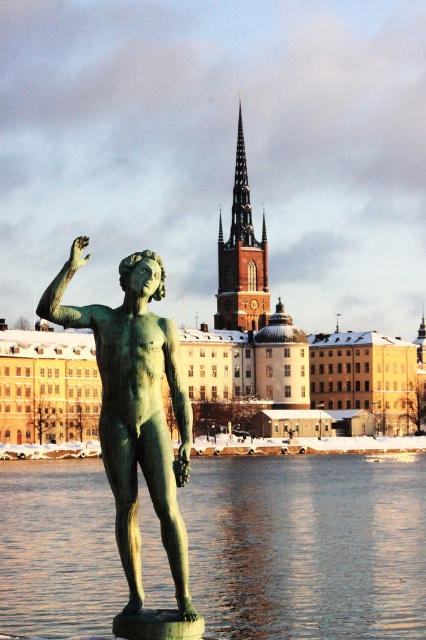
Question: Which point appears farthest from the camera in this image?

Choices:
 (A) (129, 364)
 (B) (409, 602)
 (C) (247, 186)

Answer: (C)

Question: Can you confirm if green reflective water at statue front is positioned above green patina statue at center?

Choices:
 (A) yes
 (B) no

Answer: (B)

Question: Is green reflective water at statue front in front of brown stone spire at center?

Choices:
 (A) yes
 (B) no

Answer: (A)

Question: Which object is positioned closest to the green patina statue at center?

Choices:
 (A) green reflective water at statue front
 (B) brown stone spire at center

Answer: (A)

Question: Which point is farther to the camera?

Choices:
 (A) (103, 477)
 (B) (169, 484)

Answer: (A)

Question: Does green reflective water at statue front appear on the left side of green patina statue at center?

Choices:
 (A) yes
 (B) no

Answer: (B)